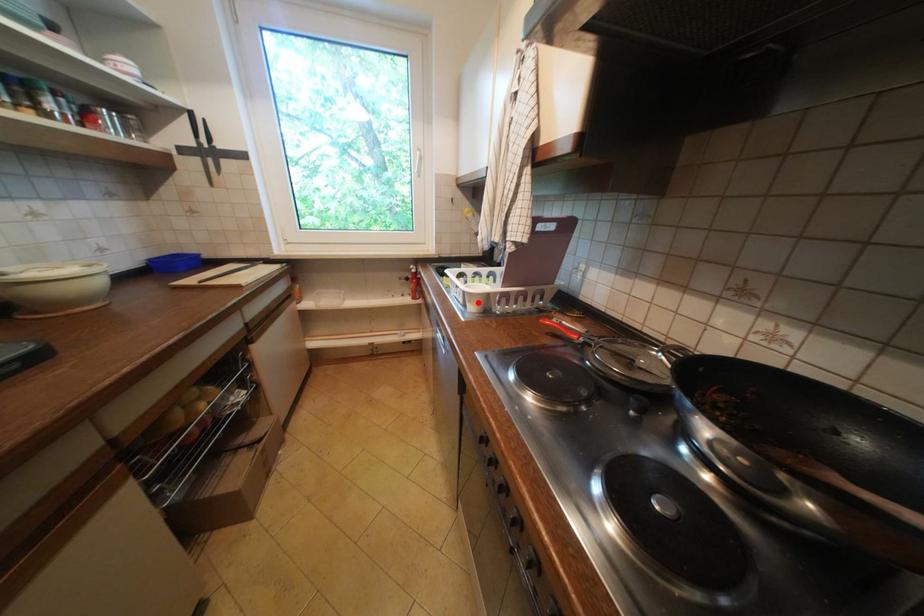
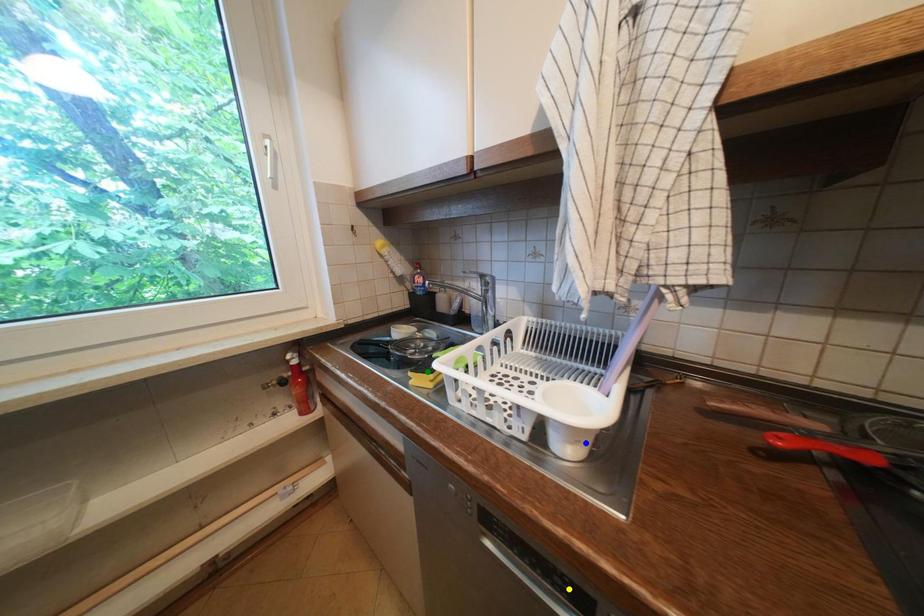
Question: I am providing you with two images of the same scene from different viewpoints. A red point is marked on the first image. You are given multiple points on the second image. Which spot in image 2 lines up with the point in image 1?

Choices:
 (A) blue point
 (B) green point
 (C) yellow point

Answer: (A)